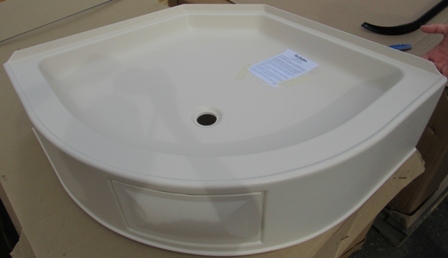
Where is `floor`? The width and height of the screenshot is (448, 258). floor is located at coordinates (412, 249).